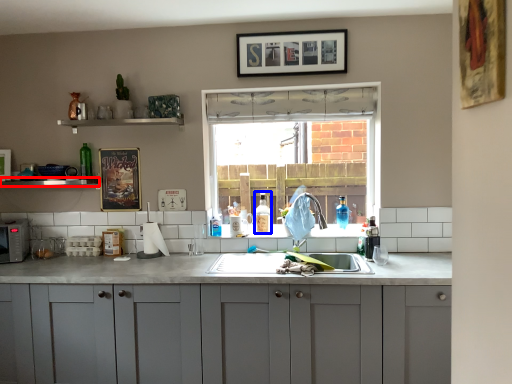
Question: Which object is closer to the camera taking this photo, window sill (highlighted by a red box) or bottle (highlighted by a blue box)?

Choices:
 (A) window sill
 (B) bottle

Answer: (A)